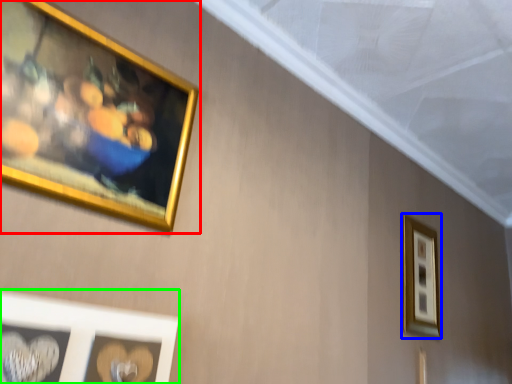
Question: Based on their relative distances, which object is nearer to picture frame (highlighted by a red box)? Choose from picture frame (highlighted by a blue box) and picture frame (highlighted by a green box).

Choices:
 (A) picture frame
 (B) picture frame

Answer: (B)